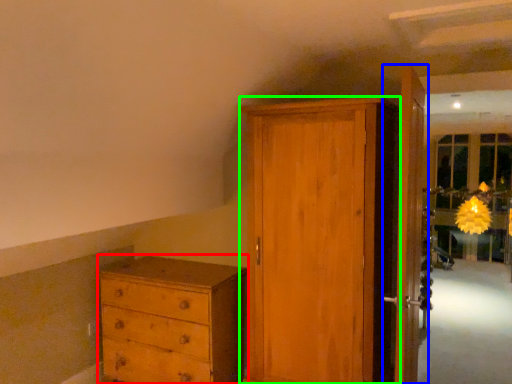
Question: Based on their relative distances, which object is farther from chest of drawers (highlighted by a red box)? Choose from door (highlighted by a blue box) and door (highlighted by a green box).

Choices:
 (A) door
 (B) door

Answer: (A)